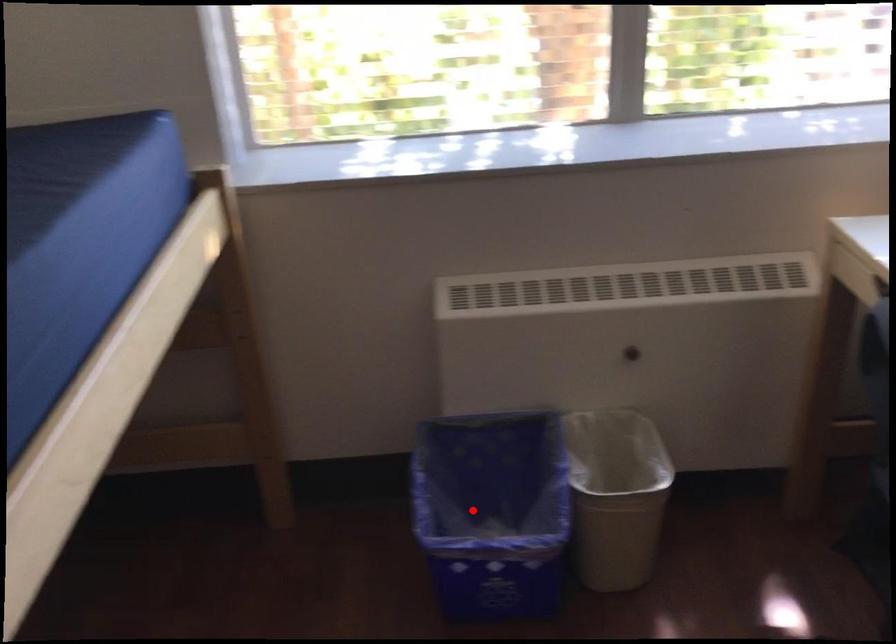
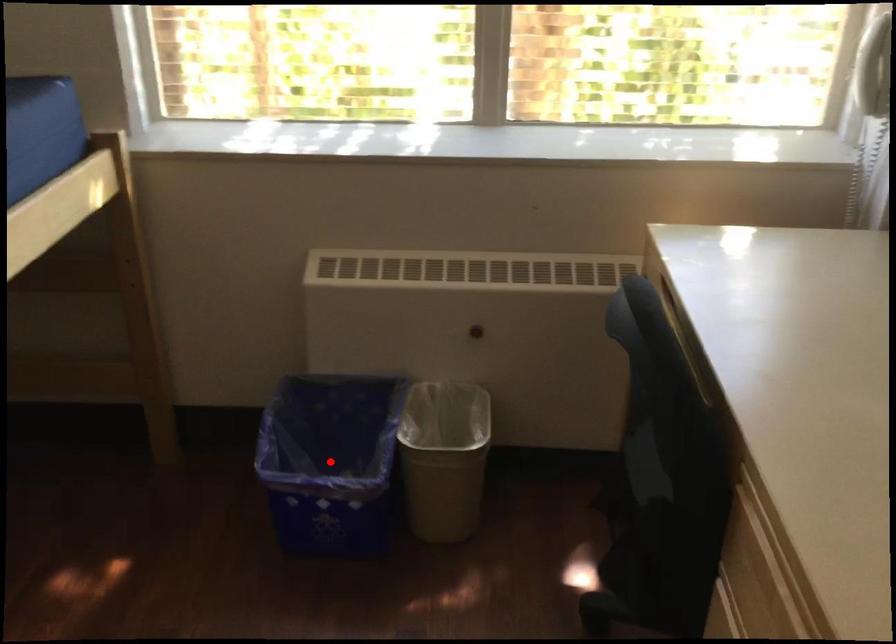
I am providing you with two images of the same scene from different viewpoints. A red point is marked on the first image and another point is marked on the second image. Is the red point in image1 aligned with the point shown in image2?

Yes